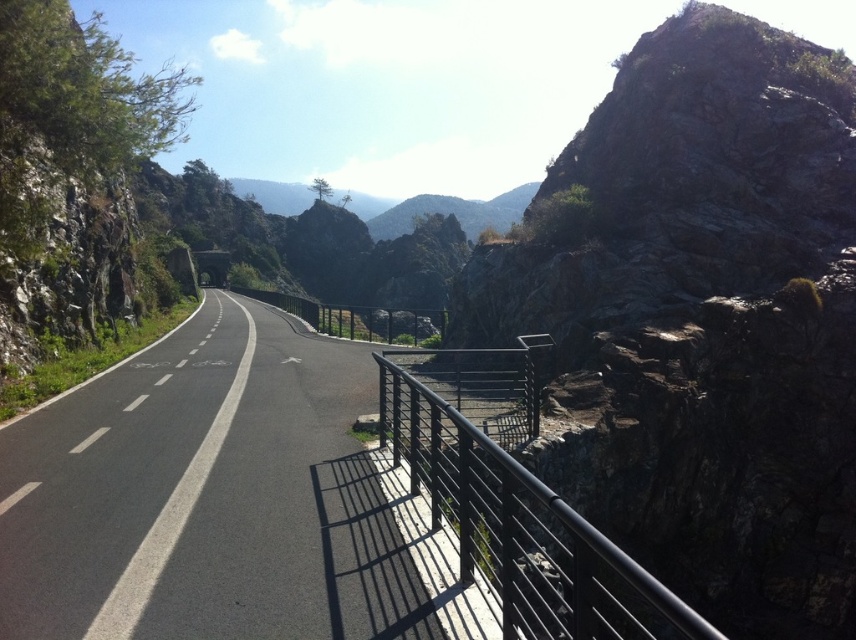
Is rugged stone mountain at upper right closer to camera compared to black asphalt highway at center?

No, rugged stone mountain at upper right is behind black asphalt highway at center.

This screenshot has width=856, height=640. What do you see at coordinates (702, 321) in the screenshot?
I see `rugged stone mountain at upper right` at bounding box center [702, 321].

Measure the distance between rugged stone mountain at upper right and camera.

rugged stone mountain at upper right and camera are 9.37 meters apart from each other.

You are a GUI agent. You are given a task and a screenshot of the screen. Output one action in this format:
    pyautogui.click(x=<x>, y=<y>)
    Task: Click on the rugged stone mountain at upper right
    
    Given the screenshot: What is the action you would take?
    pyautogui.click(x=702, y=321)

Between rugged stone mountain at upper right and black metal railing at right, which one appears on the right side from the viewer's perspective?

From the viewer's perspective, rugged stone mountain at upper right appears more on the right side.

Identify the location of rugged stone mountain at upper right. (702, 321).

Can you confirm if black asphalt highway at center is thinner than black metal railing at right?

In fact, black asphalt highway at center might be wider than black metal railing at right.

Does black asphalt highway at center have a larger size compared to black metal railing at right?

Actually, black asphalt highway at center might be smaller than black metal railing at right.

Where is `black asphalt highway at center`? black asphalt highway at center is located at coordinates (221, 500).